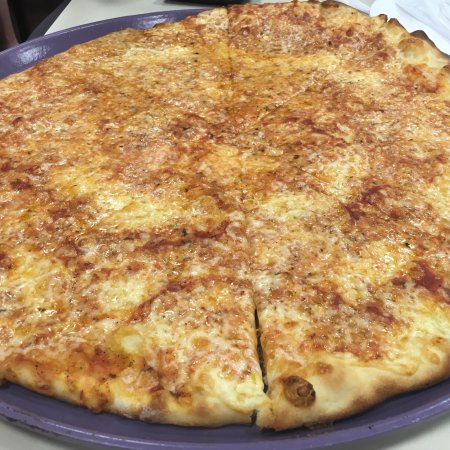
This screenshot has width=450, height=450. Identify the location of white table. (95, 13).